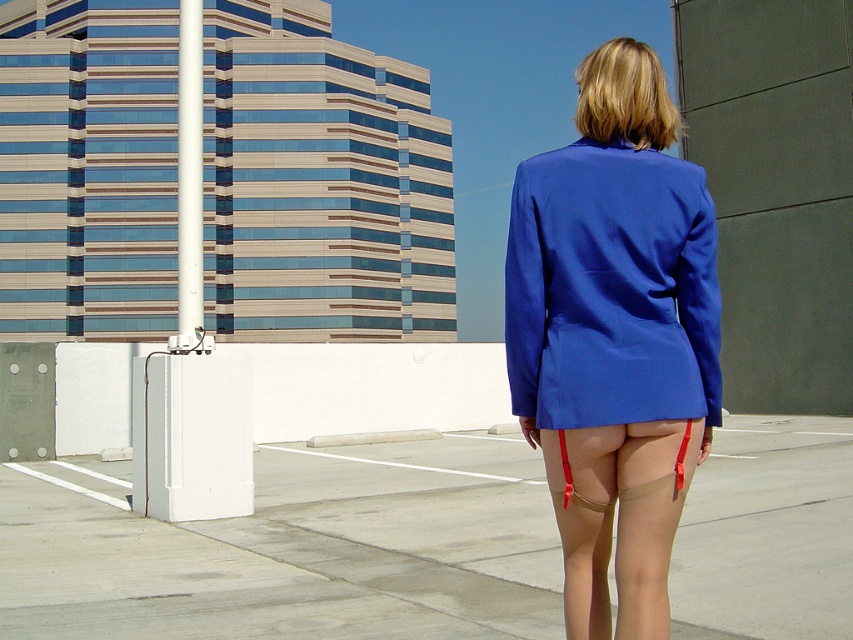
You are a fashion designer observing the scene. You notice two blazers, the blue smooth blazer at center and the matte blue blazer at center. Which one is located to the left?

The blue smooth blazer at center is positioned on the left side of the matte blue blazer at center, so the blue smooth blazer at center is located to the left.